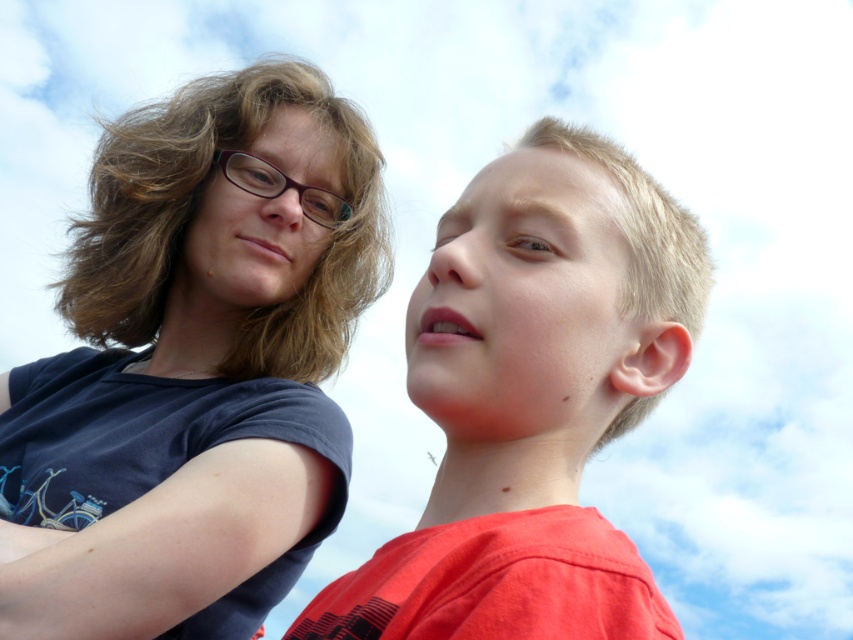
You are a photographer trying to capture a candid shot of the two people in the scene. You want to ensure that the matte blue shirt at upper left and the smooth red shirt at right are both visible in the frame. Based on their positions, which shirt should you focus on first to ensure both are in the shot?

The matte blue shirt at upper left is located below the smooth red shirt at right. To ensure both are in the frame, focus on the smooth red shirt at right first, as it is higher up, allowing the camera to capture both shirts by adjusting the angle downward.